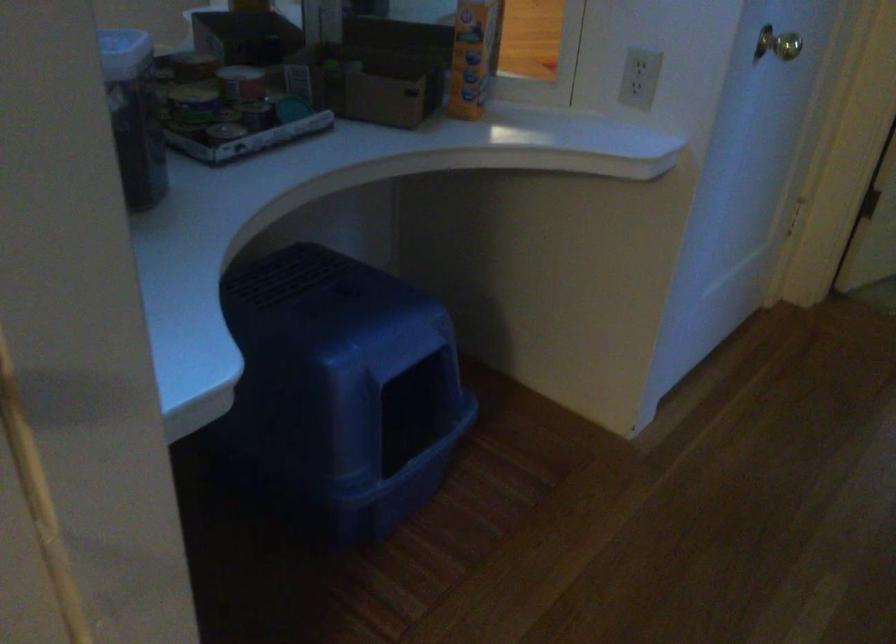
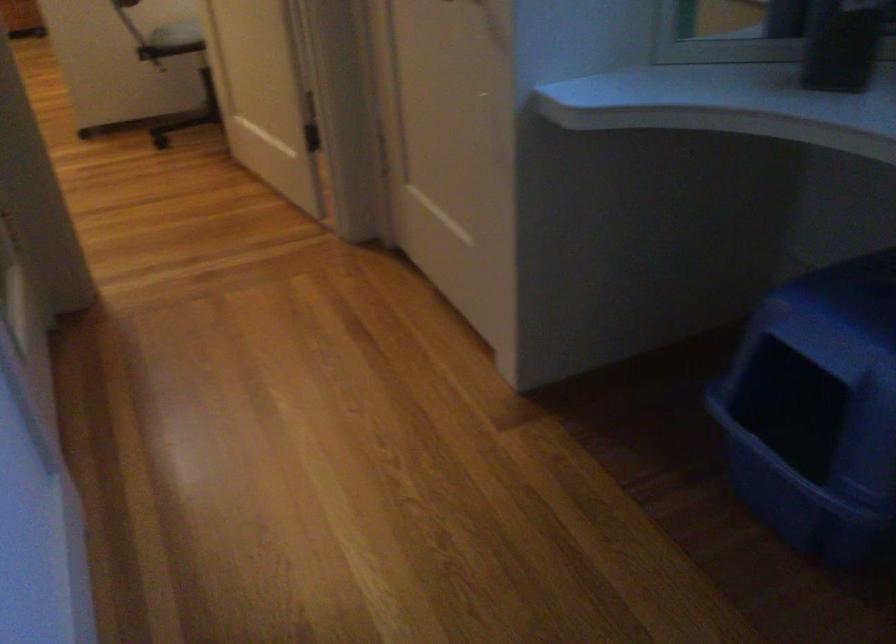
Locate, in the second image, the point that corresponds to the point at 341,388 in the first image.

(765, 275)